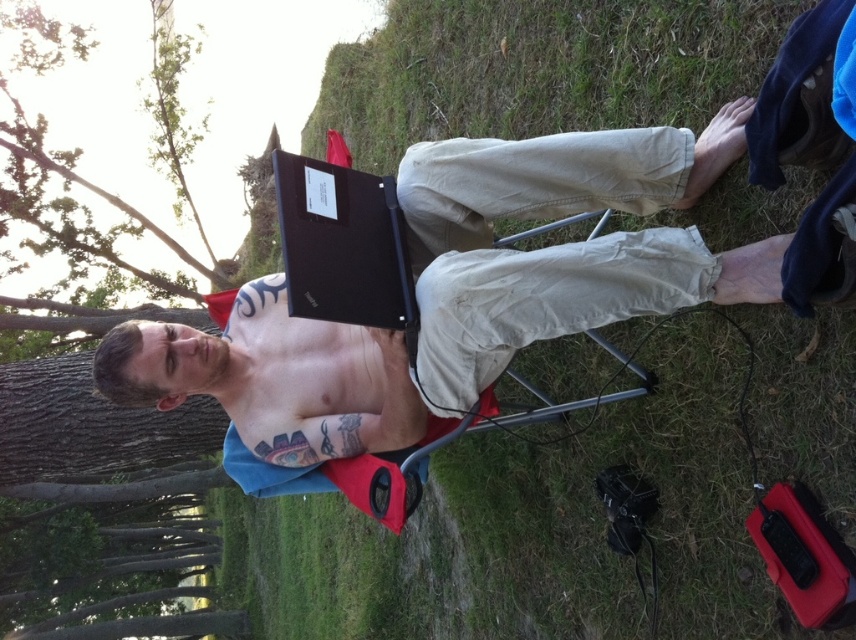
Question: Can you confirm if matte black laptop at center is thinner than shiny black laptop at center?

Choices:
 (A) yes
 (B) no

Answer: (B)

Question: Which object is the farthest from the shiny black laptop at center?

Choices:
 (A) dark brown bark tree at upper left
 (B) matte black laptop at center
 (C) black matte laptop at center

Answer: (A)

Question: Can you confirm if matte black laptop at center is positioned to the right of dark brown bark tree at upper left?

Choices:
 (A) no
 (B) yes

Answer: (B)

Question: Which object is positioned farthest from the dark brown bark tree at upper left?

Choices:
 (A) shiny black laptop at center
 (B) black matte laptop at center

Answer: (B)

Question: Can you confirm if matte black laptop at center is thinner than shiny black laptop at center?

Choices:
 (A) yes
 (B) no

Answer: (B)

Question: Estimate the real-world distances between objects in this image. Which object is closer to the dark brown bark tree at upper left?

Choices:
 (A) matte black laptop at center
 (B) shiny black laptop at center

Answer: (B)